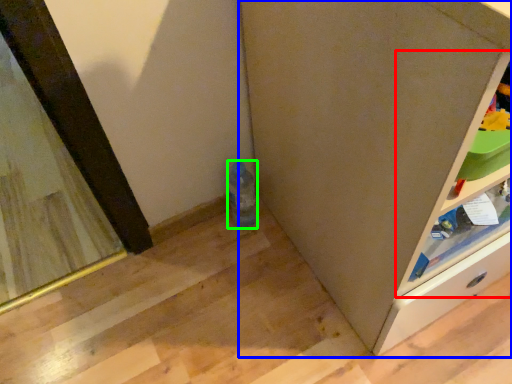
Question: Which is farther away from shelf (highlighted by a red box)? cabinetry (highlighted by a blue box) or bottle (highlighted by a green box)?

Choices:
 (A) cabinetry
 (B) bottle

Answer: (B)